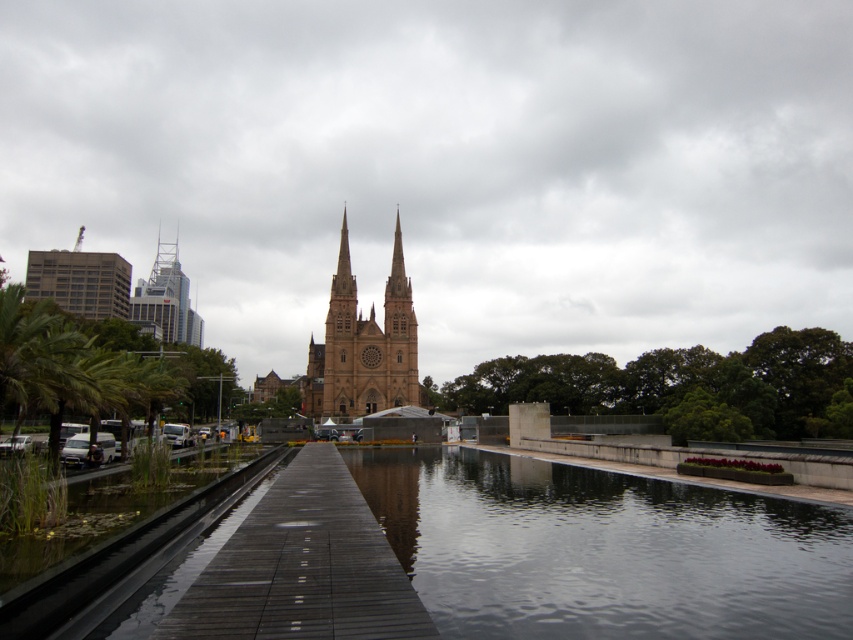
Question: Can you confirm if smooth concrete river at center is positioned above shiny glass skyscraper at left?

Choices:
 (A) yes
 (B) no

Answer: (B)

Question: Is smooth concrete river at center thinner than dark gray wooden dock at center?

Choices:
 (A) no
 (B) yes

Answer: (A)

Question: Does smooth concrete river at center appear under dark gray wooden dock at center?

Choices:
 (A) no
 (B) yes

Answer: (B)

Question: Considering the real-world distances, which object is farthest from the smooth concrete river at center?

Choices:
 (A) dark gray wooden dock at center
 (B) dark gray wooden train track at lower left
 (C) brown stone tower at center
 (D) shiny glass skyscraper at left

Answer: (D)

Question: Which point appears farthest from the camera in this image?

Choices:
 (A) (173, 307)
 (B) (84, 556)

Answer: (A)

Question: Among these points, which one is nearest to the camera?

Choices:
 (A) (782, 550)
 (B) (376, 406)
 (C) (137, 627)

Answer: (C)